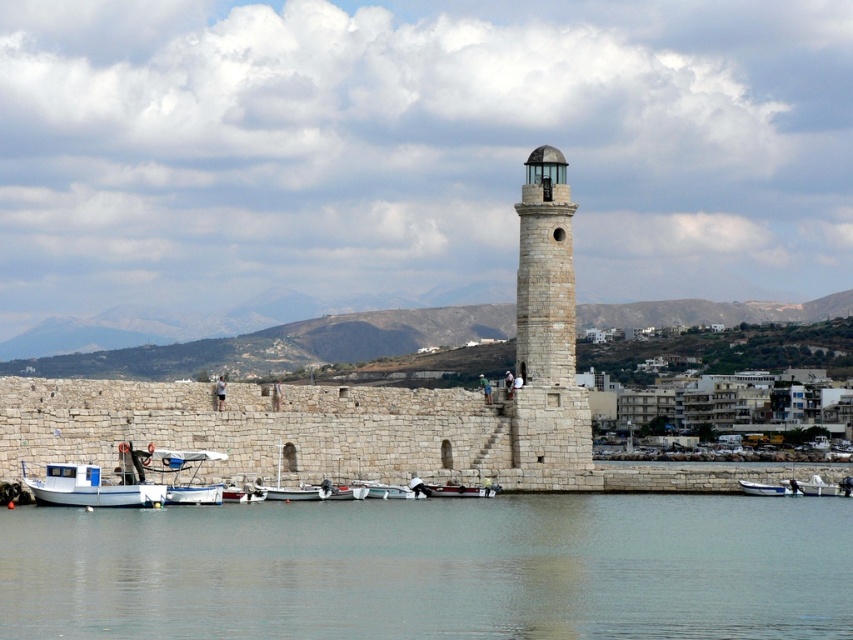
Does stone at center have a lesser height compared to white wooden boat at center?

No.

Is point (537, 374) more distant than point (450, 493)?

That is True.

The width and height of the screenshot is (853, 640). I want to click on stone at center, so click(x=354, y=397).

Looking at this image, who is more distant from viewer, (x=532, y=442) or (x=515, y=353)?

The point (x=515, y=353) is more distant.

Is stone at center shorter than stone lighthouse at center?

Correct, stone at center is not as tall as stone lighthouse at center.

Is point (62, 394) positioned behind point (526, 417)?

No, (62, 394) is in front of (526, 417).

Locate an element on the screen. stone at center is located at coordinates (354, 397).

Who is higher up, stone lighthouse at center or white matte boat at lower left?

stone lighthouse at center

Which is in front, point (569, 304) or point (146, 486)?

Positioned in front is point (146, 486).

At what (x,y) coordinates should I click in order to perform the action: click on stone lighthouse at center. Please return your answer as a coordinate pair (x, y). Image resolution: width=853 pixels, height=640 pixels. Looking at the image, I should click on (547, 328).